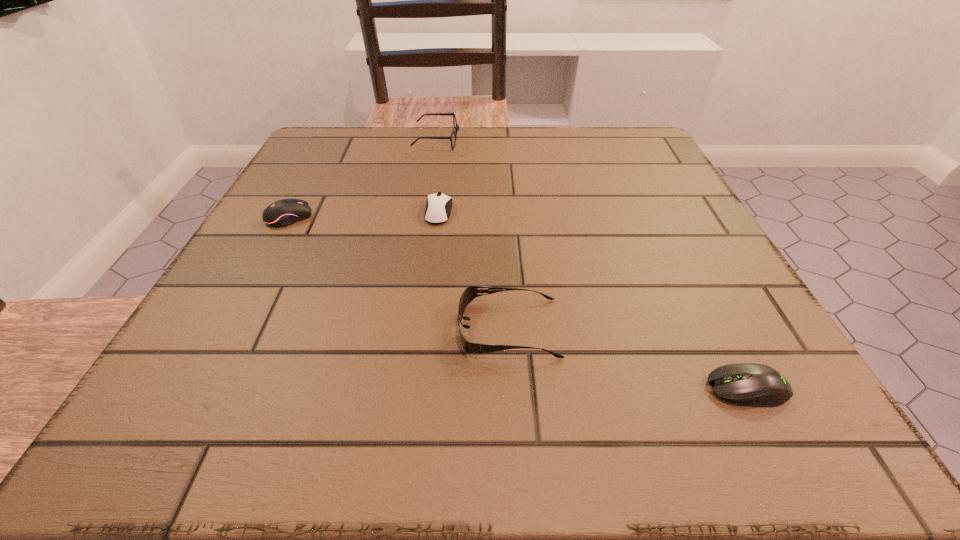
This screenshot has height=540, width=960. Find the location of `spectacles`. spectacles is located at coordinates (456, 127).

Locate an element on the screen. the tallest object is located at coordinates (456, 127).

You are a GUI agent. You are given a task and a screenshot of the screen. Output one action in this format:
    pyautogui.click(x=<x>, y=<y>)
    Task: Click on the leftmost computer mouse
    
    Given the screenshot: What is the action you would take?
    pyautogui.click(x=284, y=212)

Where is `sunglasses`? This screenshot has width=960, height=540. sunglasses is located at coordinates (471, 292).

Locate an element on the screen. This screenshot has height=540, width=960. the fourth farthest object is located at coordinates (471, 292).

This screenshot has width=960, height=540. What are the coordinates of `the second computer mouse from right to left` in the screenshot? It's located at (438, 206).

Identify the location of the rightmost object. The height and width of the screenshot is (540, 960). (748, 384).

The image size is (960, 540). I want to click on the nearest computer mouse, so click(x=748, y=384).

Locate an element on the screen. vacant space located 0.130m on the front-facing side of the tallest object is located at coordinates (512, 140).

Locate an element on the screen. This screenshot has width=960, height=540. blank area located on the back of the leftmost computer mouse is located at coordinates (331, 141).